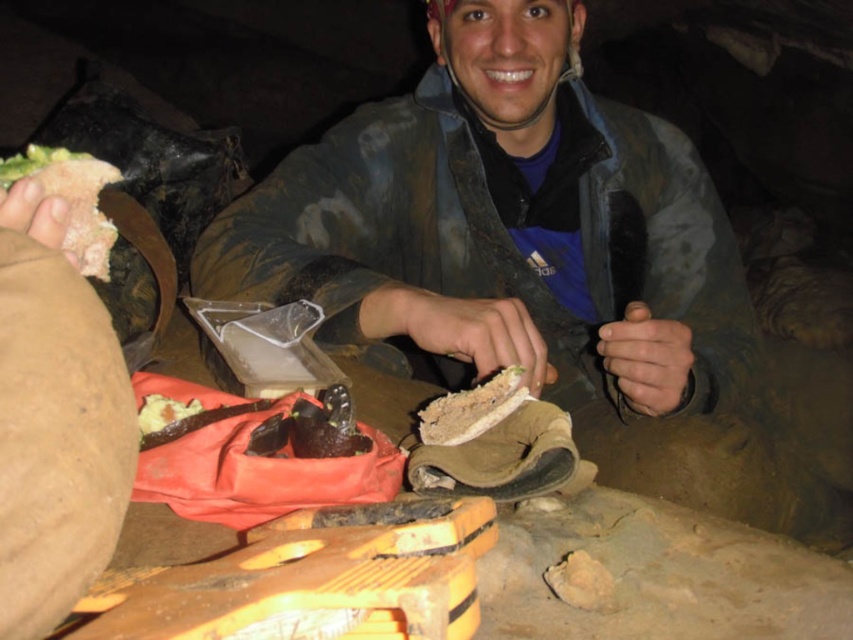
In the scene shown: Who is more distant from viewer, [74,236] or [476,412]?

Point [74,236]

Can you confirm if brown crumbly bread at left is thinner than sandy brown bread at center?

Incorrect, brown crumbly bread at left's width is not less than sandy brown bread at center's.

Which is behind, point (84, 160) or point (468, 413)?

The point (84, 160) is more distant.

Where is `brown crumbly bread at left`? This screenshot has height=640, width=853. brown crumbly bread at left is located at coordinates (71, 198).

The height and width of the screenshot is (640, 853). Describe the element at coordinates (471, 408) in the screenshot. I see `sandy brown bread at center` at that location.

Which is in front, point (460, 420) or point (166, 404)?

Positioned in front is point (460, 420).

You are a GUI agent. You are given a task and a screenshot of the screen. Output one action in this format:
    pyautogui.click(x=<x>, y=<y>)
    Task: Click on the sandy brown bread at center
    The width and height of the screenshot is (853, 640).
    Given the screenshot: What is the action you would take?
    pyautogui.click(x=471, y=408)

Describe the element at coordinates (71, 198) in the screenshot. Image resolution: width=853 pixels, height=640 pixels. I see `brown crumbly bread at left` at that location.

Based on the photo, is brown crumbly bread at left positioned before brown crumbly bread at center?

Yes, it is.

Measure the distance between brown crumbly bread at left and camera.

brown crumbly bread at left is 63.35 centimeters away from camera.

At what (x,y) coordinates should I click in order to perform the action: click on brown crumbly bread at left. Please return your answer as a coordinate pair (x, y). The height and width of the screenshot is (640, 853). Looking at the image, I should click on (71, 198).